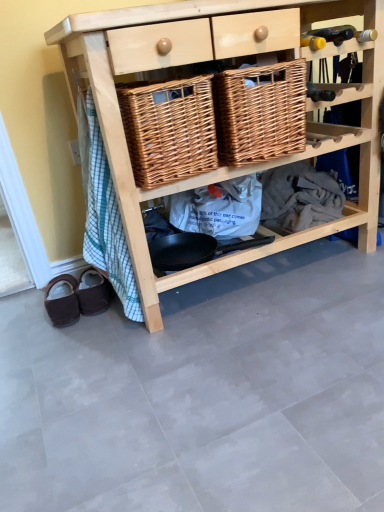
Question: Is brown suede mule at lower left, which is counted as the second footwear, starting from the left, wider than brown suede slippers at lower left, which is the 1th footwear in left-to-right order?

Choices:
 (A) no
 (B) yes

Answer: (A)

Question: From the image's perspective, is brown suede mule at lower left, which is counted as the second footwear, starting from the left, below brown suede slippers at lower left, the second footwear from the right?

Choices:
 (A) yes
 (B) no

Answer: (B)

Question: Is brown suede mule at lower left, which is counted as the first footwear, starting from the right, facing towards brown suede slippers at lower left, which is the 1th footwear in left-to-right order?

Choices:
 (A) yes
 (B) no

Answer: (B)

Question: Is brown suede mule at lower left, which is counted as the second footwear, starting from the left, surrounding brown suede slippers at lower left, the second footwear from the right?

Choices:
 (A) no
 (B) yes

Answer: (A)

Question: Is brown suede mule at lower left, which is counted as the first footwear, starting from the right, far from brown suede slippers at lower left, which is the 1th footwear in left-to-right order?

Choices:
 (A) no
 (B) yes

Answer: (A)

Question: Is natural wood shelf at center wider or thinner than brown suede mule at lower left, which is counted as the second footwear, starting from the left?

Choices:
 (A) thin
 (B) wide

Answer: (B)

Question: From the image's perspective, is natural wood shelf at center located above or below brown suede mule at lower left, which is counted as the second footwear, starting from the left?

Choices:
 (A) above
 (B) below

Answer: (A)

Question: Choose the correct answer: Is natural wood shelf at center inside brown suede mule at lower left, which is counted as the second footwear, starting from the left, or outside it?

Choices:
 (A) outside
 (B) inside

Answer: (A)

Question: Relative to brown suede mule at lower left, which is counted as the first footwear, starting from the right, is natural wood shelf at center in front or behind?

Choices:
 (A) behind
 (B) front

Answer: (B)

Question: Considering the positions of point (360, 162) and point (46, 307), is point (360, 162) closer or farther from the camera than point (46, 307)?

Choices:
 (A) closer
 (B) farther

Answer: (B)

Question: From their relative heights in the image, would you say natural wood shelf at center is taller or shorter than brown suede slippers at lower left, the second footwear from the right?

Choices:
 (A) short
 (B) tall

Answer: (B)

Question: Is natural wood shelf at center wider or thinner than brown suede slippers at lower left, the second footwear from the right?

Choices:
 (A) wide
 (B) thin

Answer: (A)

Question: Based on their sizes in the image, would you say natural wood shelf at center is bigger or smaller than brown suede slippers at lower left, the second footwear from the right?

Choices:
 (A) small
 (B) big

Answer: (B)

Question: Is point (238, 126) closer or farther from the camera than point (266, 41)?

Choices:
 (A) farther
 (B) closer

Answer: (A)

Question: In the image, is woven brown basket at center, acting as the second basket starting from the left, positioned in front of or behind natural wood shelf at center?

Choices:
 (A) behind
 (B) front

Answer: (A)